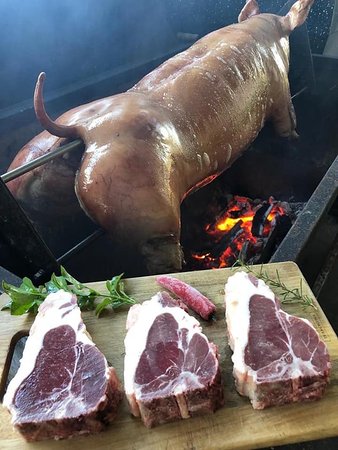
Show me where where you hang the cutting board are located in the image. Your answer should be formatted as a list of tuples, i.e. [(x1, y1), (x2, y2), ...], where each tuple contains the x and y coordinates of a point satisfying the conditions above.

[(14, 361)]